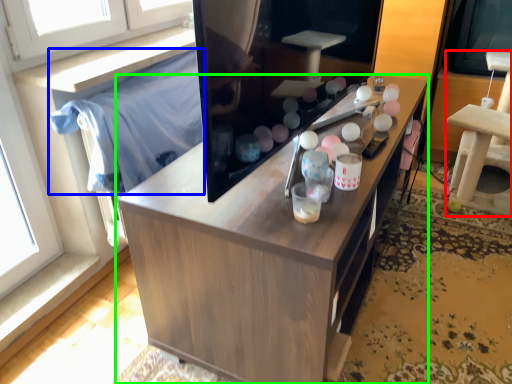
Question: Which object is the farthest from furniture (highlighted by a red box)? Choose among these: cloth (highlighted by a blue box) or cabinetry (highlighted by a green box).

Choices:
 (A) cloth
 (B) cabinetry

Answer: (A)